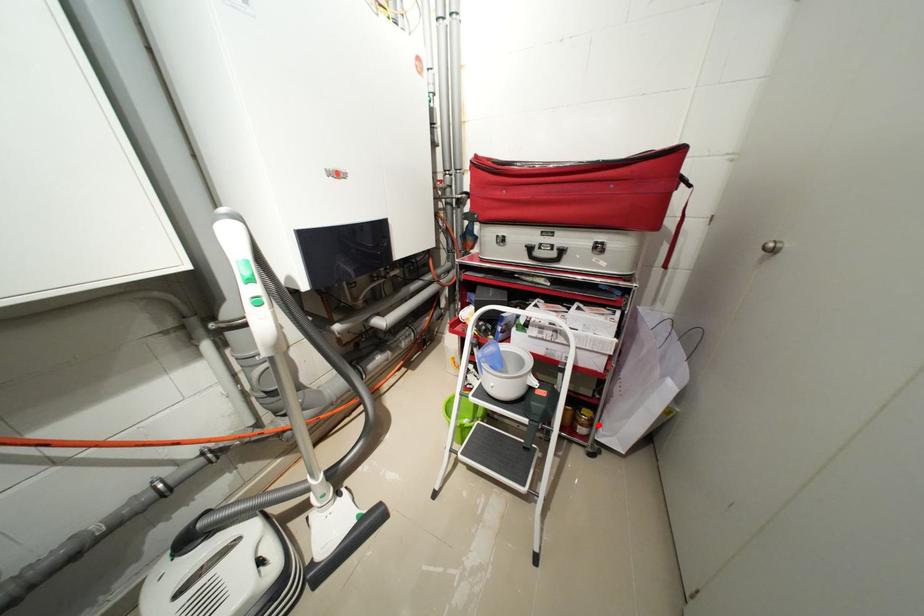
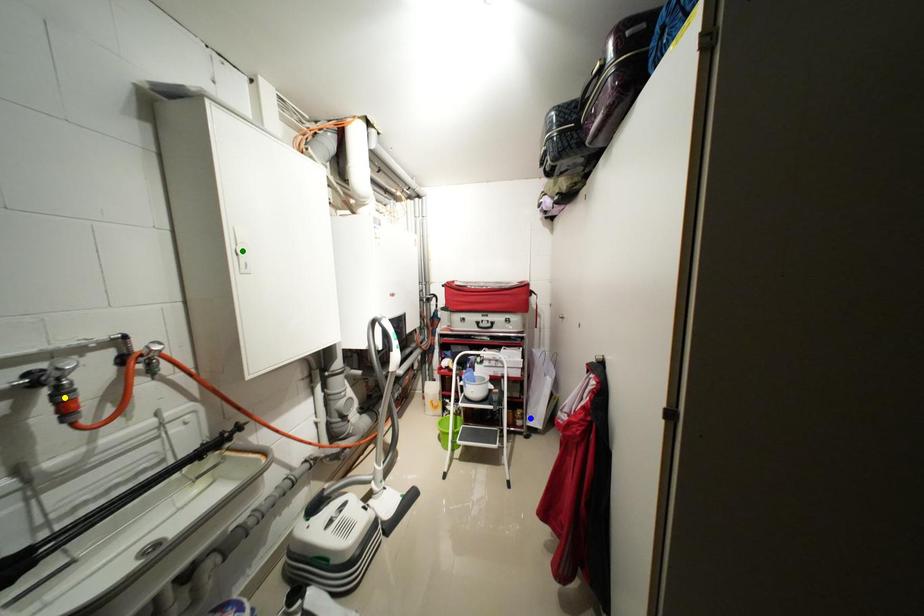
Question: I am providing you with two images of the same scene from different viewpoints. A red point is marked on the first image. You are given multiple points on the second image. Can you choose the point in image 2 that corresponds to the point in image 1?

Choices:
 (A) yellow point
 (B) green point
 (C) blue point

Answer: (C)